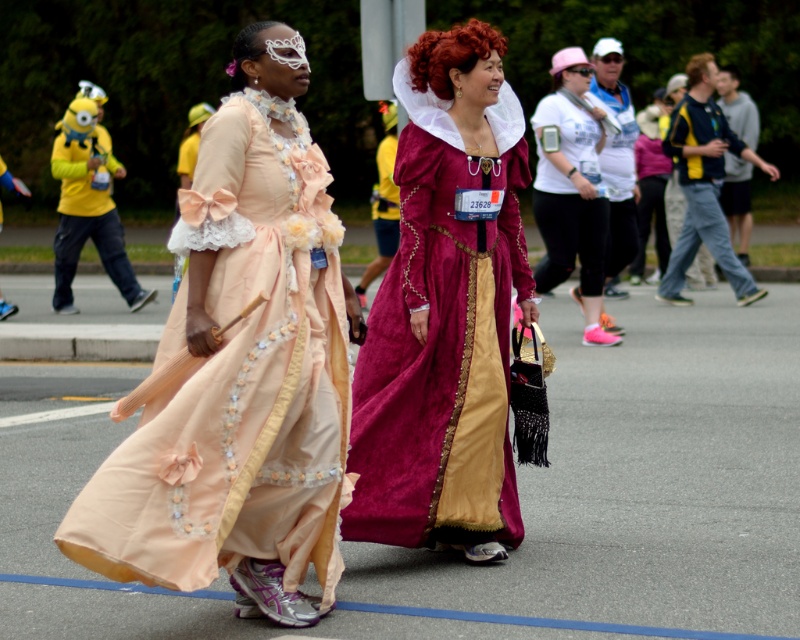
You are a photographer trying to capture both the white lace wig at upper center and the brown fuzzy wig at upper center in a single shot. Which wig should you focus on first to ensure both are in frame?

The white lace wig at upper center is positioned under the brown fuzzy wig at upper center, so you should focus on the brown fuzzy wig at upper center first to ensure both are in frame.

You are a photographer trying to capture both the velvet maroon gown at center and the yellow plush toy at left in the same frame. Based on their sizes, which one should you focus on first to ensure they are both in focus?

The velvet maroon gown at center is taller than the yellow plush toy at left, so you should focus on the taller velvet maroon gown at center first to ensure both are in focus.

You are a photographer at the event and need to capture a photo that includes both the yellow plush toy at left and the brown fuzzy wig at upper center. Given that your camera has a maximum focus range of 15 feet, will you be able to include both subjects in the same frame without moving closer?

The yellow plush toy at left is 18.10 feet away from the brown fuzzy wig at upper center. Since the distance exceeds the camera maximum focus range of 15 feet, you cannot include both subjects in the same frame without moving closer.